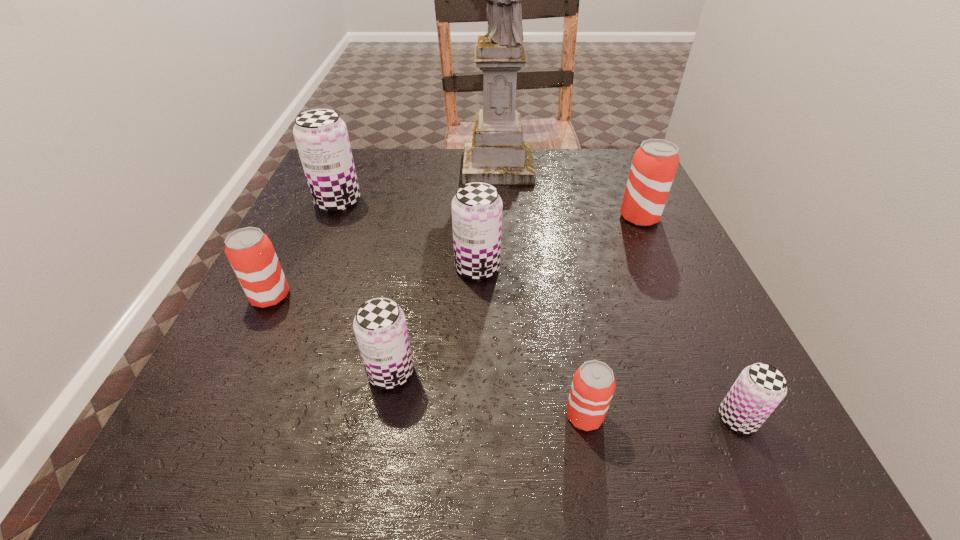
Image resolution: width=960 pixels, height=540 pixels. In order to click on the tallest object in this screenshot , I will do `click(497, 154)`.

What are the coordinates of `gray sculpture` in the screenshot? It's located at (497, 154).

Find the location of a particular element. the farthest purple beer can is located at coordinates (321, 136).

At what (x,y) coordinates should I click in order to perform the action: click on the biggest purple beer can. Please return your answer as a coordinate pair (x, y). The width and height of the screenshot is (960, 540). Looking at the image, I should click on (321, 136).

In order to click on the rightmost orange beer can in this screenshot , I will do `click(654, 165)`.

This screenshot has width=960, height=540. Identify the location of the biggest orange beer can. (654, 165).

This screenshot has width=960, height=540. What are the coordinates of `the fourth beer can from right to left` in the screenshot? It's located at (477, 208).

Locate an element on the screen. the third nearest purple beer can is located at coordinates (477, 208).

Identify the location of the leftmost orange beer can. (250, 252).

In order to click on the second farthest orange beer can in this screenshot , I will do `click(250, 252)`.